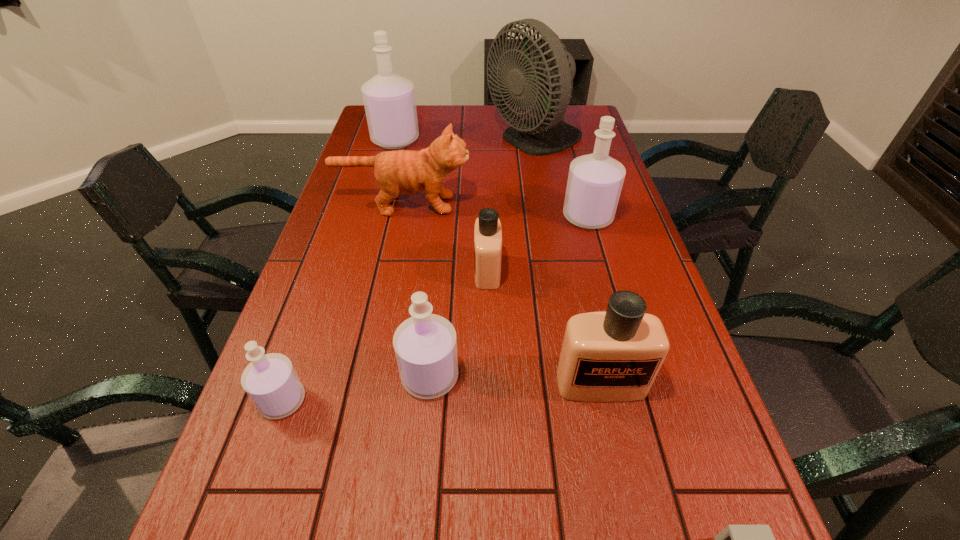
Select which purple perfume appears as the fourth closest to the fan. Please provide its 2D coordinates. Your answer should be formatted as a tuple, i.e. [(x, y)], where the tuple contains the x and y coordinates of a point satisfying the conditions above.

[(270, 380)]

Image resolution: width=960 pixels, height=540 pixels. I want to click on purple perfume that stands as the third closest to the smallest purple perfume, so click(x=389, y=99).

Find the location of a particular element. vacant space that satisfies the following two spatial constraints: 1. on the back side of the farthest perfume; 2. on the left side of the smallest purple perfume is located at coordinates (374, 139).